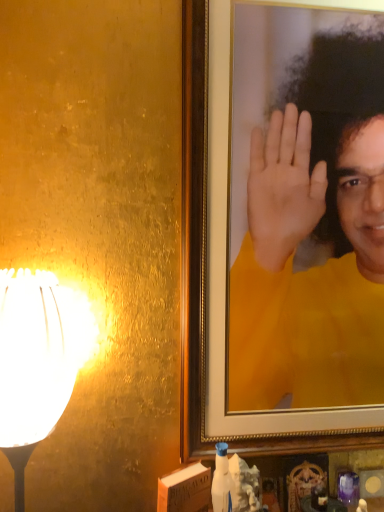
What do you see at coordinates (315, 234) in the screenshot? This screenshot has height=512, width=384. I see `yellow matte portrait at upper right` at bounding box center [315, 234].

The height and width of the screenshot is (512, 384). In order to click on yellow matte portrait at upper right in this screenshot , I will do `click(315, 234)`.

What do you see at coordinates (38, 360) in the screenshot?
I see `white glossy lampshade at left` at bounding box center [38, 360].

Locate an element on the screen. This screenshot has height=512, width=384. white glossy lampshade at left is located at coordinates (38, 360).

At what (x,y) coordinates should I click in order to perform the action: click on yellow matte portrait at upper right. Please return your answer as a coordinate pair (x, y). Looking at the image, I should click on (315, 234).

Is white glossy lampshade at left at the right side of yellow matte portrait at upper right?

In fact, white glossy lampshade at left is to the left of yellow matte portrait at upper right.

Is white glossy lampshade at left closer to the viewer compared to yellow matte portrait at upper right?

Yes, white glossy lampshade at left is closer to the viewer.

Does point (42, 405) come in front of point (365, 350)?

Yes, it is.

From the image's perspective, which one is positioned lower, white glossy lampshade at left or yellow matte portrait at upper right?

white glossy lampshade at left appears lower in the image.

From a real-world perspective, who is located lower, white glossy lampshade at left or yellow matte portrait at upper right?

In real-world perspective, white glossy lampshade at left is lower.

Which object is wider, white glossy lampshade at left or yellow matte portrait at upper right?

white glossy lampshade at left is wider.

In terms of height, does white glossy lampshade at left look taller or shorter compared to yellow matte portrait at upper right?

In the image, white glossy lampshade at left appears to be shorter than yellow matte portrait at upper right.

In terms of size, does white glossy lampshade at left appear bigger or smaller than yellow matte portrait at upper right?

Considering their sizes, white glossy lampshade at left takes up less space than yellow matte portrait at upper right.

Based on the photo, is yellow matte portrait at upper right completely or partially inside white glossy lampshade at left?

No, white glossy lampshade at left does not contain yellow matte portrait at upper right.

Is white glossy lampshade at left in contact with yellow matte portrait at upper right?

No, white glossy lampshade at left is not next to yellow matte portrait at upper right.

Is yellow matte portrait at upper right at the back of white glossy lampshade at left?

No.

In order to click on lamp lying below the yellow matte portrait at upper right (from the image's perspective) in this screenshot , I will do `click(38, 360)`.

Does yellow matte portrait at upper right appear on the left side of white glossy lampshade at left?

No, yellow matte portrait at upper right is not to the left of white glossy lampshade at left.

Consider the image. Is the position of yellow matte portrait at upper right less distant than that of white glossy lampshade at left?

No, the depth of yellow matte portrait at upper right is greater than that of white glossy lampshade at left.

Considering the points (377, 399) and (40, 352), which point is behind, point (377, 399) or point (40, 352)?

The point (377, 399) is farther from the camera.

From the image's perspective, is yellow matte portrait at upper right over white glossy lampshade at left?

Yes, from the image's perspective, yellow matte portrait at upper right is over white glossy lampshade at left.

From a real-world perspective, is yellow matte portrait at upper right physically below white glossy lampshade at left?

No, from a real-world perspective, yellow matte portrait at upper right is not under white glossy lampshade at left.

Which object is wider, yellow matte portrait at upper right or white glossy lampshade at left?

white glossy lampshade at left.

Between yellow matte portrait at upper right and white glossy lampshade at left, which one has more height?

With more height is yellow matte portrait at upper right.

Consider the image. Does yellow matte portrait at upper right have a smaller size compared to white glossy lampshade at left?

Incorrect, yellow matte portrait at upper right is not smaller in size than white glossy lampshade at left.

Is white glossy lampshade at left completely or partially inside yellow matte portrait at upper right?

No, white glossy lampshade at left is located outside of yellow matte portrait at upper right.

Are yellow matte portrait at upper right and white glossy lampshade at left far apart?

They are positioned close to each other.

Is yellow matte portrait at upper right looking in the opposite direction of white glossy lampshade at left?

No, white glossy lampshade at left is not at the back of yellow matte portrait at upper right.

In the scene shown: What's the angular difference between yellow matte portrait at upper right and white glossy lampshade at left's facing directions?

39.5 degrees.

How far apart are yellow matte portrait at upper right and white glossy lampshade at left?

18.48 inches.

Locate an element on the screen. lamp located underneath the yellow matte portrait at upper right (from a real-world perspective) is located at coordinates (38, 360).

In order to click on lamp on the left of yellow matte portrait at upper right in this screenshot , I will do `click(38, 360)`.

The width and height of the screenshot is (384, 512). Identify the location of lamp below the yellow matte portrait at upper right (from a real-world perspective). (38, 360).